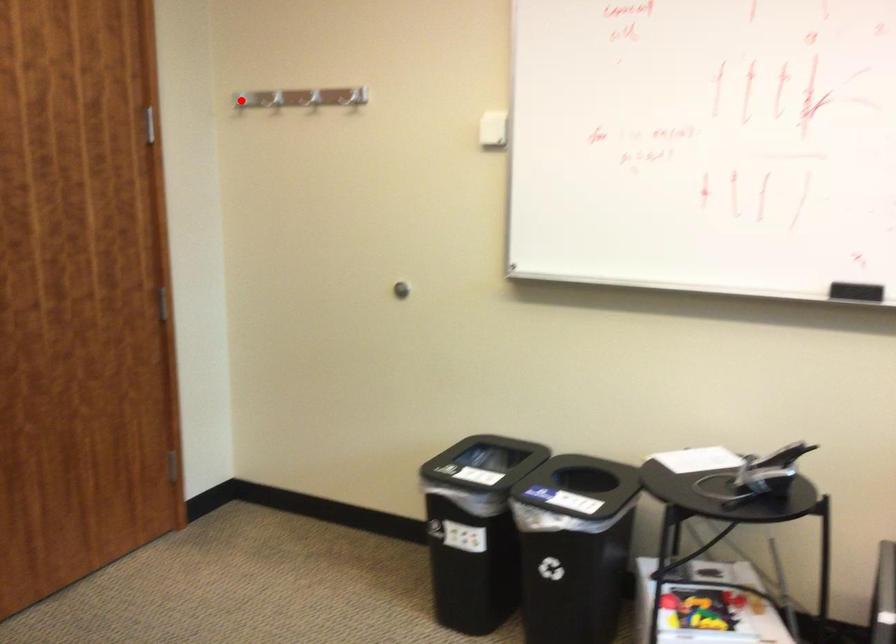
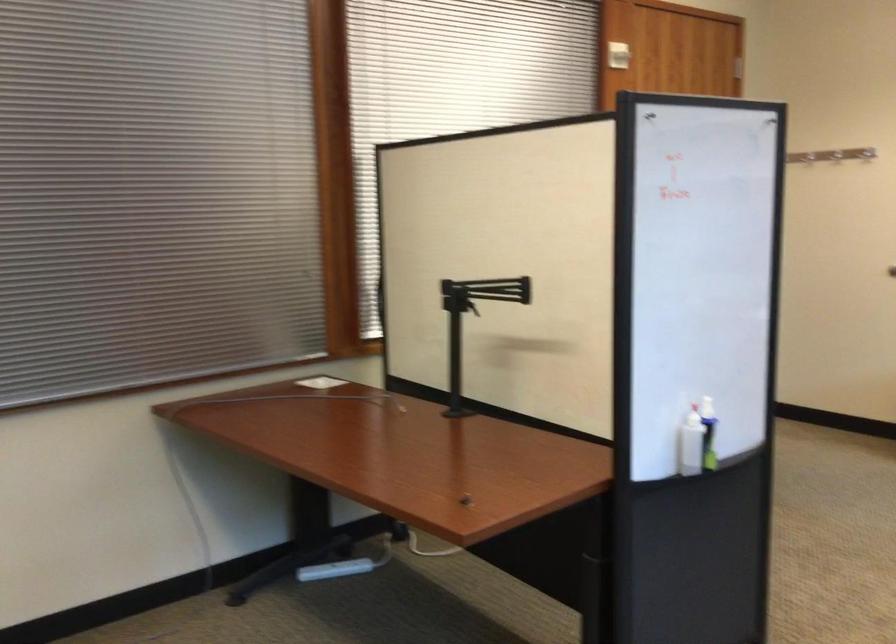
Question: I am providing you with two images of the same scene from different viewpoints. A red point is marked on the first image. Is the red point's position out of view in image 2?

Choices:
 (A) Yes
 (B) No

Answer: (A)